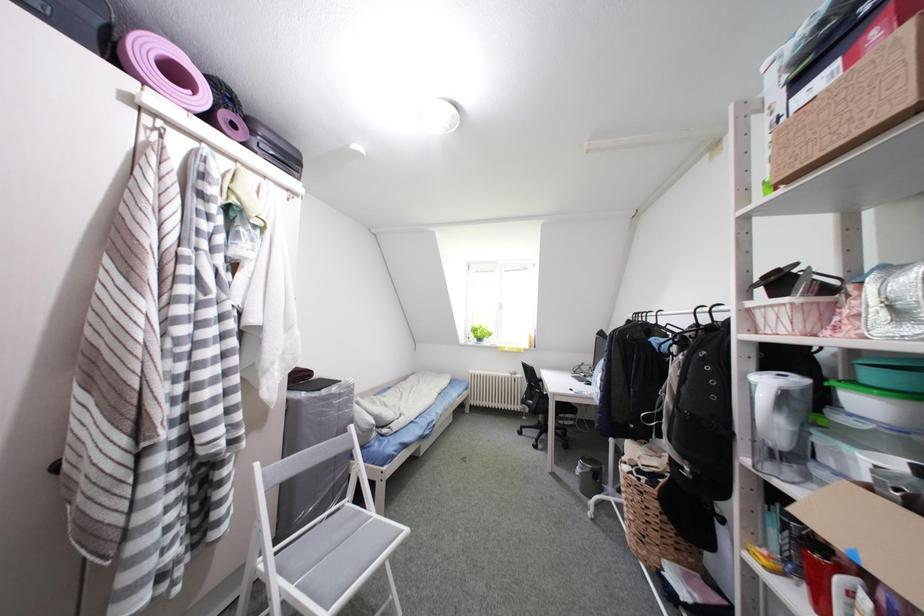
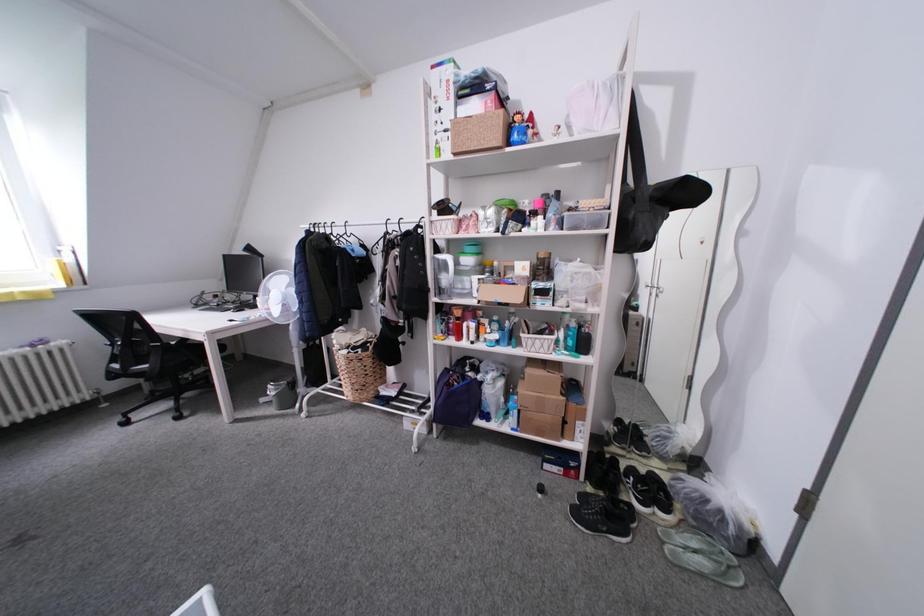
From the picture: The images are taken continuously from a first-person perspective. In which direction is your viewpoint rotating?

The camera's rotation is toward right-down.